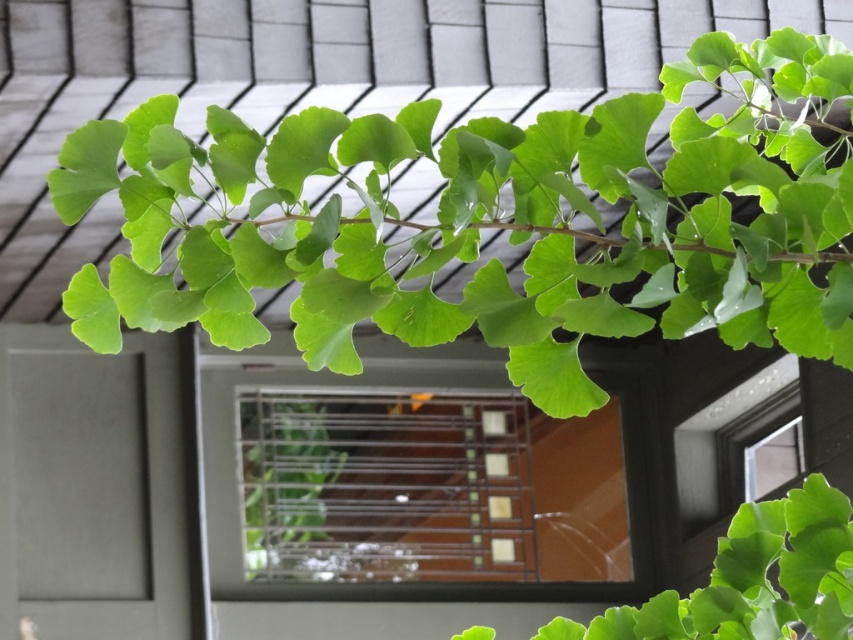
Question: Is green matte leafy branch at upper center above green matte leaf at center?

Choices:
 (A) no
 (B) yes

Answer: (B)

Question: Which point is closer to the camera taking this photo?

Choices:
 (A) (805, 509)
 (B) (293, 188)
 (C) (498, 589)

Answer: (B)

Question: Does green matte leafy branch at upper center appear over clear glass window at center?

Choices:
 (A) yes
 (B) no

Answer: (A)

Question: Can you confirm if green matte leafy branch at upper center is positioned to the right of green matte leaf at center?

Choices:
 (A) no
 (B) yes

Answer: (A)

Question: Which object is the closest to the green matte leaf at center?

Choices:
 (A) clear glass window at center
 (B) green matte leafy branch at upper center

Answer: (B)

Question: Estimate the real-world distances between objects in this image. Which object is closer to the green matte leafy branch at upper center?

Choices:
 (A) green matte leaf at center
 (B) clear glass window at center

Answer: (A)